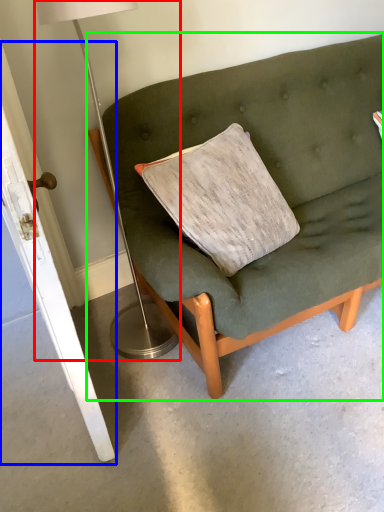
Question: Which is farther away from table lamp (highlighted by a red box)? door (highlighted by a blue box) or studio couch (highlighted by a green box)?

Choices:
 (A) door
 (B) studio couch

Answer: (B)